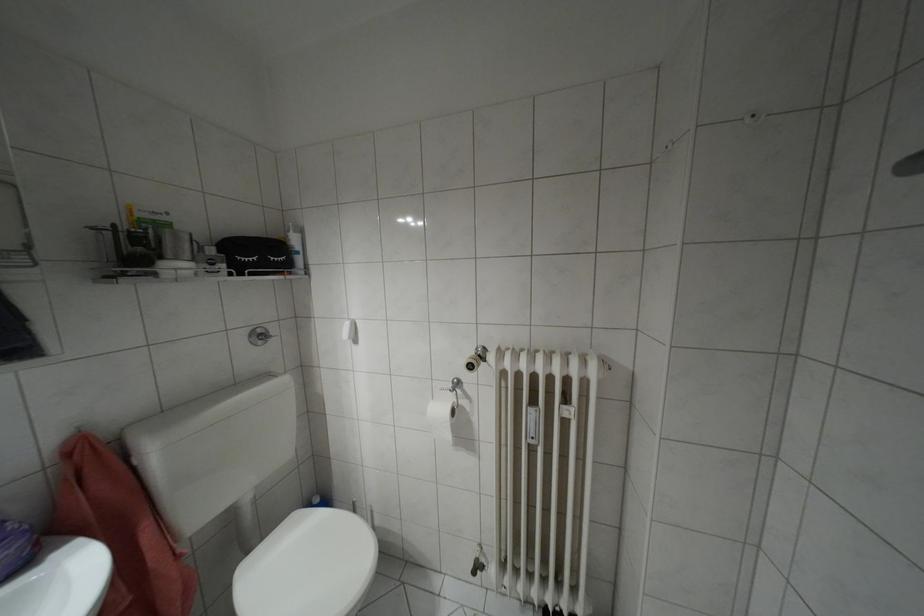
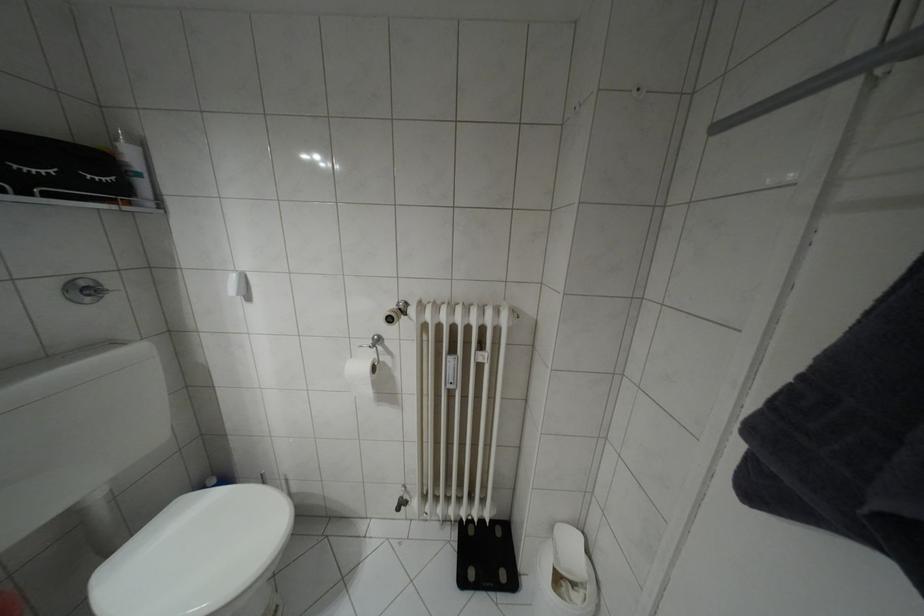
In the second image, find the point that corresponds to point (448, 436) in the first image.

(369, 392)